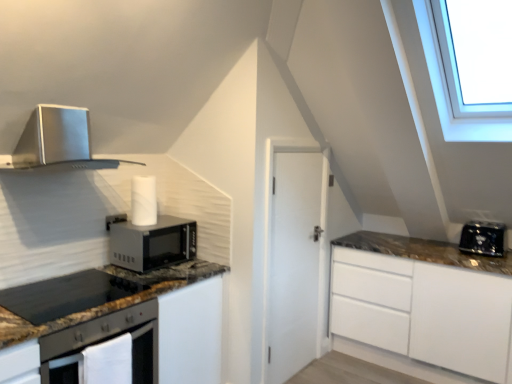
Question: Can you confirm if satin silver range hood at upper left is positioned to the right of black granite gas stove at lower left?

Choices:
 (A) yes
 (B) no

Answer: (B)

Question: From the image's perspective, is satin silver range hood at upper left below black granite gas stove at lower left?

Choices:
 (A) no
 (B) yes

Answer: (A)

Question: Can you confirm if satin silver range hood at upper left is smaller than black granite gas stove at lower left?

Choices:
 (A) no
 (B) yes

Answer: (A)

Question: Can you confirm if satin silver range hood at upper left is thinner than black granite gas stove at lower left?

Choices:
 (A) yes
 (B) no

Answer: (A)

Question: From a real-world perspective, does satin silver range hood at upper left sit lower than black granite gas stove at lower left?

Choices:
 (A) no
 (B) yes

Answer: (A)

Question: Is the position of satin silver range hood at upper left more distant than that of black granite gas stove at lower left?

Choices:
 (A) no
 (B) yes

Answer: (B)

Question: Is satin silver range hood at upper left completely or partially outside of metallic matte microwave oven at center-left?

Choices:
 (A) yes
 (B) no

Answer: (A)

Question: Considering the relative positions of satin silver range hood at upper left and metallic matte microwave oven at center-left in the image provided, is satin silver range hood at upper left to the right of metallic matte microwave oven at center-left from the viewer's perspective?

Choices:
 (A) yes
 (B) no

Answer: (B)

Question: Can you confirm if satin silver range hood at upper left is thinner than metallic matte microwave oven at center-left?

Choices:
 (A) no
 (B) yes

Answer: (A)

Question: Is satin silver range hood at upper left shorter than metallic matte microwave oven at center-left?

Choices:
 (A) no
 (B) yes

Answer: (A)

Question: Is satin silver range hood at upper left looking in the opposite direction of metallic matte microwave oven at center-left?

Choices:
 (A) yes
 (B) no

Answer: (B)

Question: Is satin silver range hood at upper left next to metallic matte microwave oven at center-left and touching it?

Choices:
 (A) no
 (B) yes

Answer: (A)

Question: Does black granite gas stove at lower left have a smaller size compared to black plastic toaster at right?

Choices:
 (A) yes
 (B) no

Answer: (A)